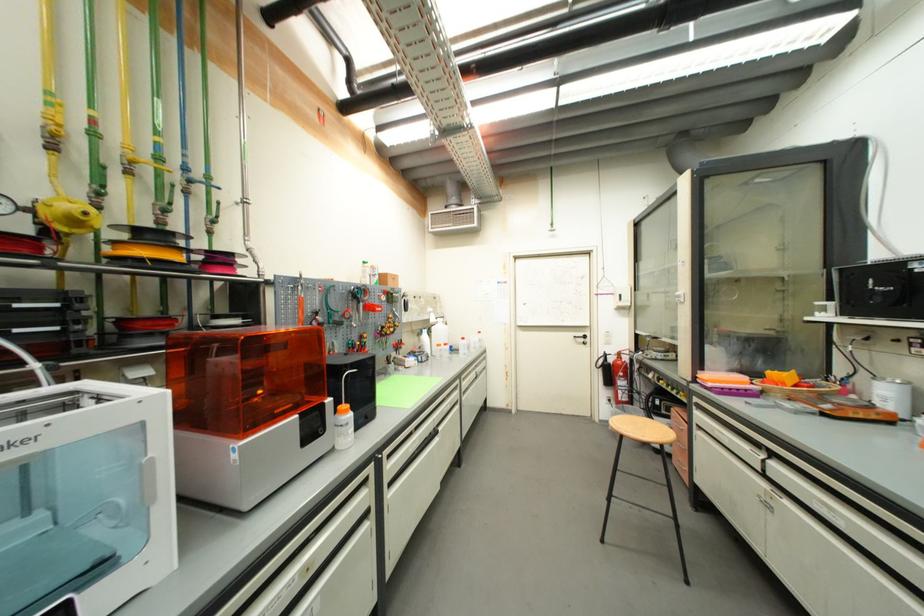
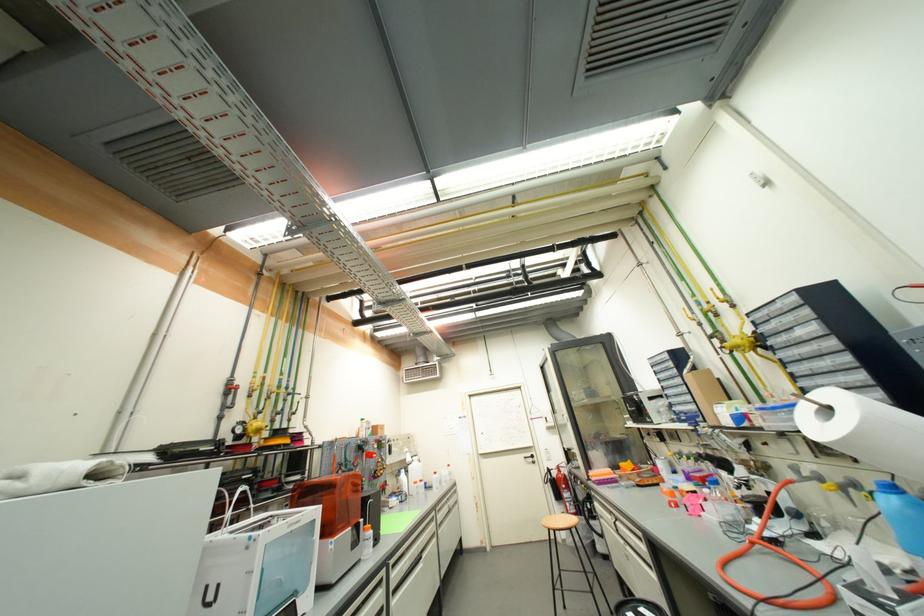
In the second image, find the point that corresponds to point 630,387 in the first image.

(575, 500)